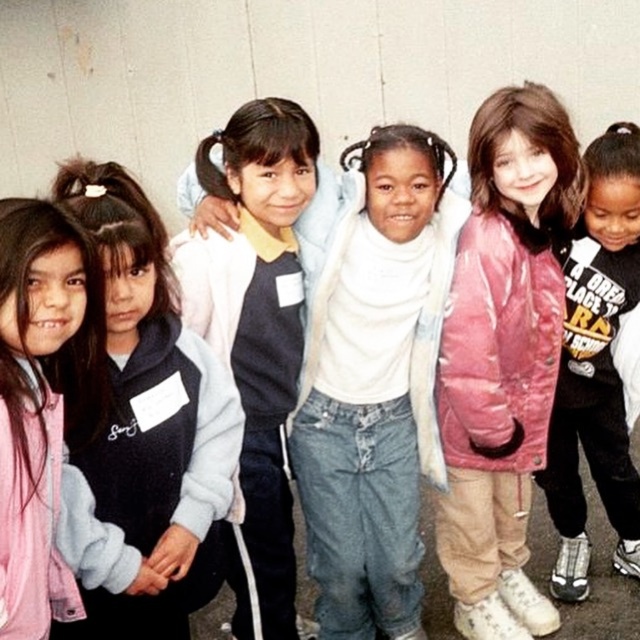
Question: Which point is farther from the camera taking this photo?

Choices:
 (A) (605, 436)
 (B) (76, 364)
 (C) (284, 113)
 (D) (515, 545)

Answer: (D)

Question: Which of the following is the closest to the observer?

Choices:
 (A) (540, 173)
 (B) (316, 180)
 (C) (13, 632)
 (D) (582, 403)

Answer: (C)

Question: Which object appears farthest from the camera in this image?

Choices:
 (A) white matte jacket at center
 (B) pink fleece jacket at left
 (C) pink shiny jacket at center

Answer: (C)

Question: Is pink shiny jacket at center above white matte jacket at center?

Choices:
 (A) yes
 (B) no

Answer: (A)

Question: Does pink shiny jacket at center appear under pink fleece jacket at center?

Choices:
 (A) no
 (B) yes

Answer: (B)

Question: Can you confirm if white matte jacket at center is positioned above pink fleece jacket at left?

Choices:
 (A) yes
 (B) no

Answer: (A)